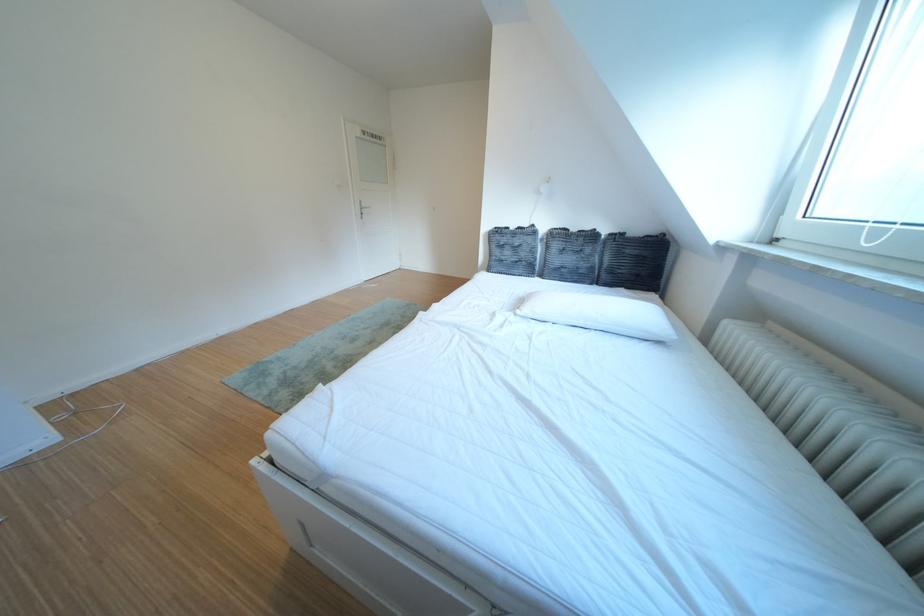
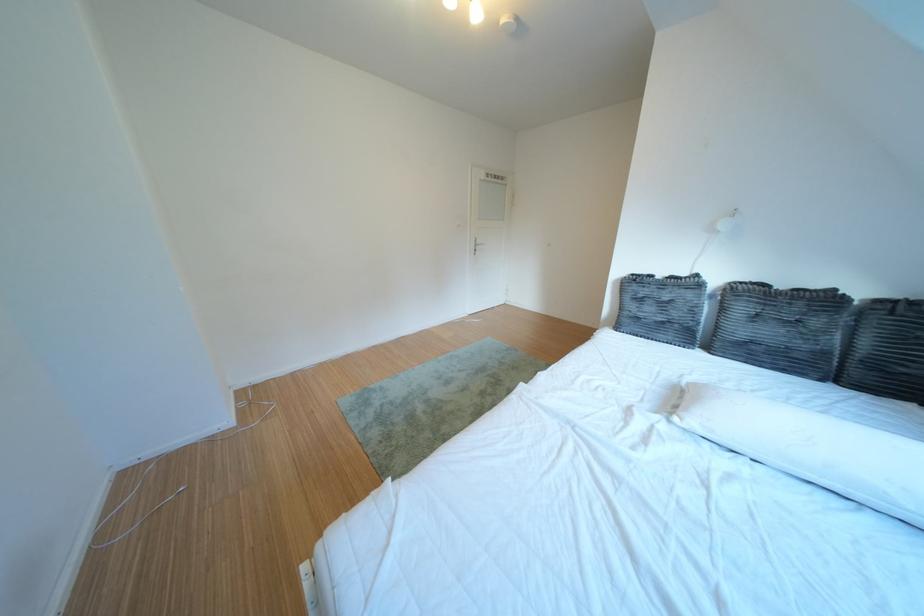
Locate, in the second image, the point that corresponds to (x=507, y=264) in the first image.

(639, 318)